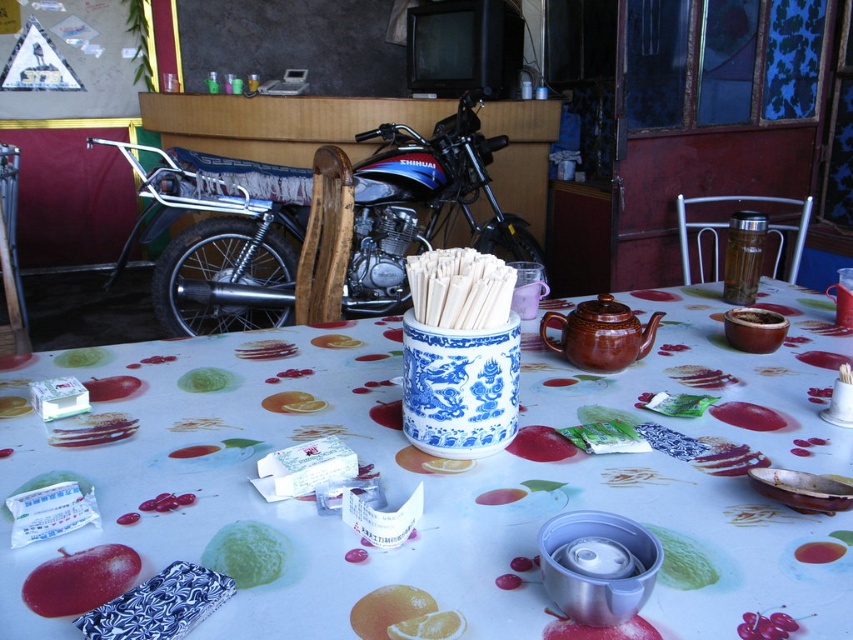
What is the exact 2D coordinate of the shiny metallic motorcycle at center?

The shiny metallic motorcycle at center is located at the exact 2D coordinate of point (318,227).